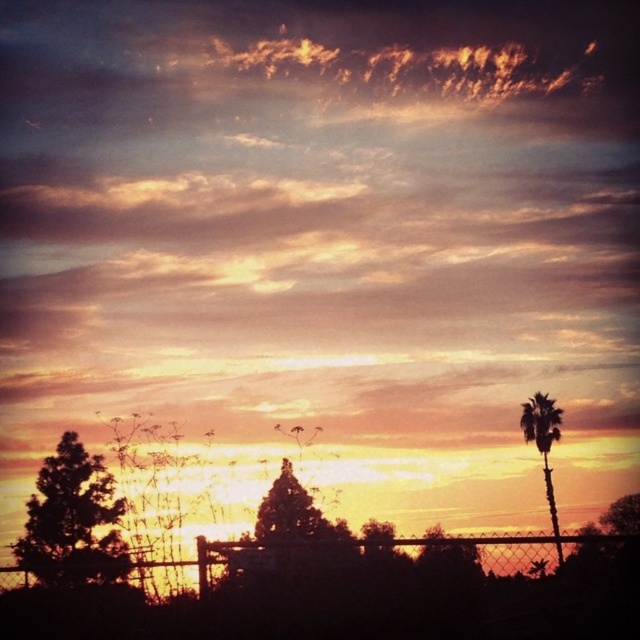
Consider the image. You are a painter setting up your easel to capture the sunset scene. You want to position yourself so that both the wire mesh fence at lower center and the green leafy tree at lower left are visible in your painting. Which object will appear taller in your painting?

The green leafy tree at lower left will appear taller in the painting because it is taller than the wire mesh fence at lower center.